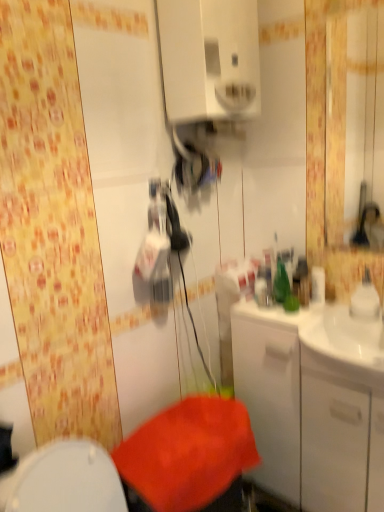
Question: From a real-world perspective, is white glossy cabinet at right above or below white glossy medicine cabinet at upper center?

Choices:
 (A) above
 (B) below

Answer: (B)

Question: Is point (297, 460) positioned closer to the camera than point (175, 37)?

Choices:
 (A) farther
 (B) closer

Answer: (A)

Question: Estimate the real-world distances between objects in this image. Which object is farther from the white glossy medicine cabinet at upper center?

Choices:
 (A) white glossy cabinet at right
 (B) glossy plastic mirror at upper right

Answer: (B)

Question: Considering the real-world distances, which object is farthest from the white glossy cabinet at right?

Choices:
 (A) glossy plastic mirror at upper right
 (B) white glossy medicine cabinet at upper center

Answer: (A)